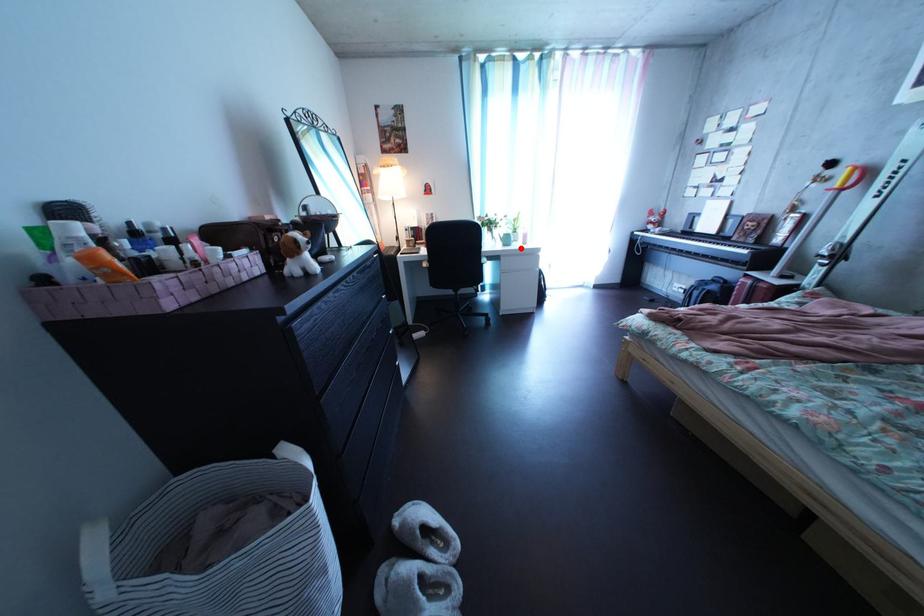
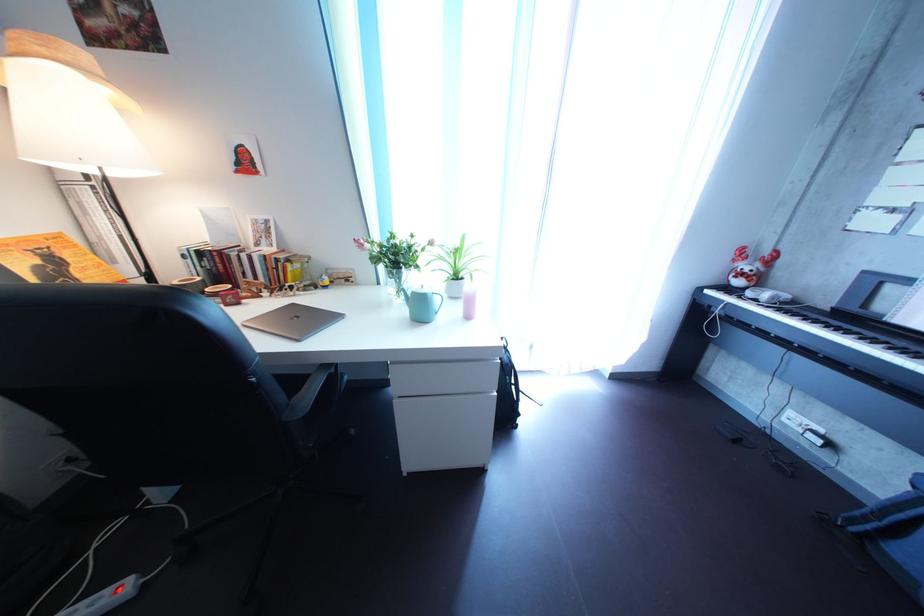
Find the pixel in the second image that matches the highlighted location in the first image.

(433, 315)